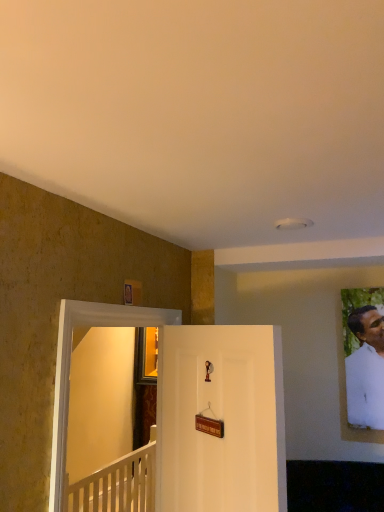
Question: Are transparent glass door at left and white matte door at center far apart?

Choices:
 (A) yes
 (B) no

Answer: (B)

Question: Is white matte door at center located within transparent glass door at left?

Choices:
 (A) no
 (B) yes

Answer: (A)

Question: Is the position of transparent glass door at left more distant than that of white matte door at center?

Choices:
 (A) no
 (B) yes

Answer: (A)

Question: Considering the relative positions of transparent glass door at left and white matte door at center in the image provided, is transparent glass door at left to the left of white matte door at center from the viewer's perspective?

Choices:
 (A) yes
 (B) no

Answer: (A)

Question: Is transparent glass door at left completely or partially outside of white matte door at center?

Choices:
 (A) yes
 (B) no

Answer: (A)

Question: Does point (188, 379) appear closer or farther from the camera than point (104, 506)?

Choices:
 (A) farther
 (B) closer

Answer: (B)

Question: In the image, is white matte door at center on the left side or the right side of white wooden railing at lower left?

Choices:
 (A) left
 (B) right

Answer: (B)

Question: From the image's perspective, relative to white wooden railing at lower left, is white matte door at center above or below?

Choices:
 (A) below
 (B) above

Answer: (B)

Question: In terms of size, does white matte door at center appear bigger or smaller than white wooden railing at lower left?

Choices:
 (A) small
 (B) big

Answer: (A)

Question: Considering the positions of point (49, 473) and point (367, 404), is point (49, 473) closer or farther from the camera than point (367, 404)?

Choices:
 (A) closer
 (B) farther

Answer: (A)

Question: From a real-world perspective, relative to white matte portrait at right, is transparent glass door at left vertically above or below?

Choices:
 (A) above
 (B) below

Answer: (B)

Question: Based on their sizes in the image, would you say transparent glass door at left is bigger or smaller than white matte portrait at right?

Choices:
 (A) big
 (B) small

Answer: (A)

Question: In the image, is transparent glass door at left positioned in front of or behind white matte portrait at right?

Choices:
 (A) front
 (B) behind

Answer: (A)

Question: Based on their positions, is white matte portrait at right located to the left or right of white wooden railing at lower left?

Choices:
 (A) left
 (B) right

Answer: (B)

Question: Is point (350, 387) closer or farther from the camera than point (79, 483)?

Choices:
 (A) farther
 (B) closer

Answer: (B)